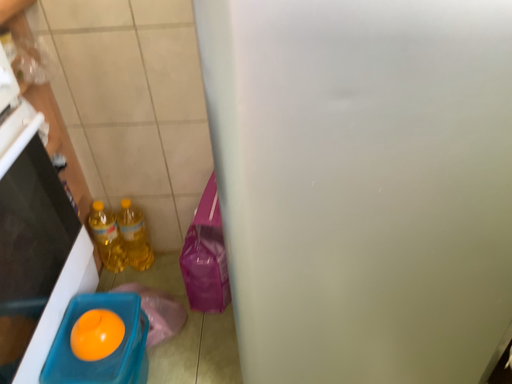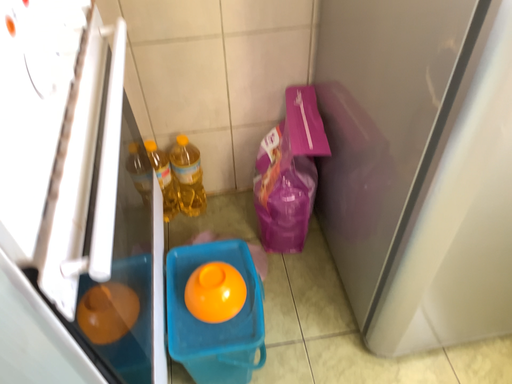
Question: Which way did the camera rotate in the video?

Choices:
 (A) rotated upward
 (B) rotated downward

Answer: (B)